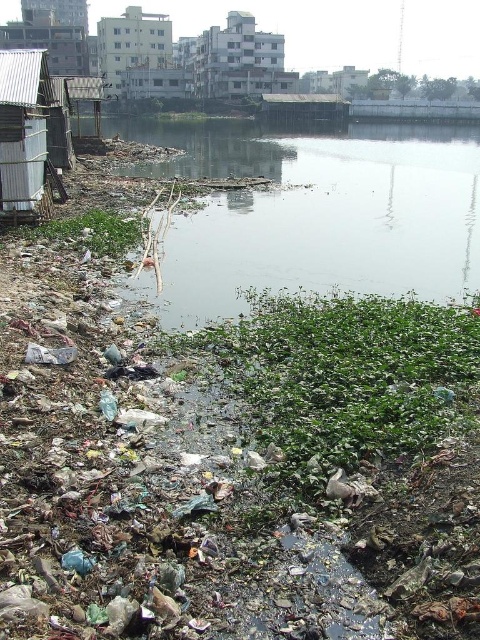
You are a city planner reviewing this area. You need to determine the spatial arrangement between the metal corrugated hut at left and the white concrete building at upper center. Which one is located to the right side of the other?

The metal corrugated hut at left is positioned on the right side of white concrete building at upper center.

You are a waste collector standing at the edge of the polluted shoreline. You see the dirty plastic debris at lower left and the metal corrugated hut at left. Which object is closer to you?

The dirty plastic debris at lower left is closer to you because it is in front of the metal corrugated hut at left.

You are a city planner reviewing this area for cleanup. You observe the point marked at coordinates (32, 134). What structure is located at this point?

The point at coordinates (32, 134) indicates a metal corrugated hut at left.